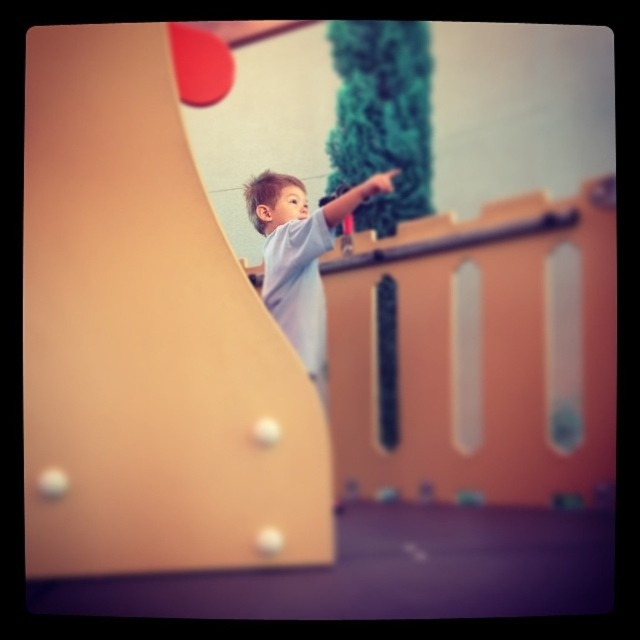
Between matte plastic slide at center and light blue t-shirt at center, which one is positioned higher?

Positioned higher is light blue t-shirt at center.

Between point (170, 381) and point (371, 188), which one is positioned in front?

Point (371, 188) is in front.

At what (x,y) coordinates should I click in order to perform the action: click on matte plastic slide at center. Please return your answer as a coordinate pair (x, y). Image resolution: width=640 pixels, height=640 pixels. Looking at the image, I should click on (148, 339).